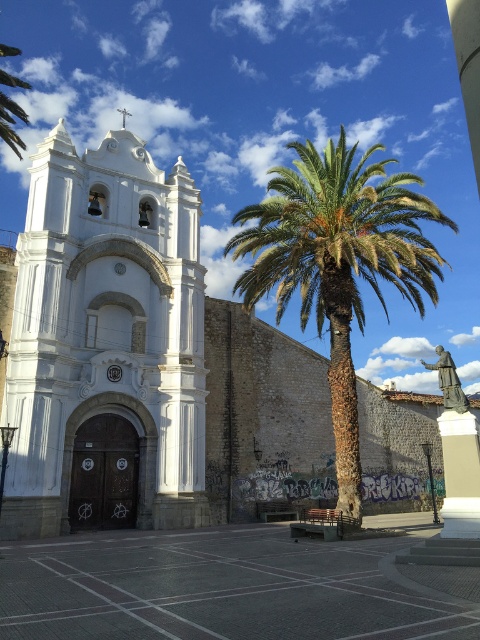
Question: Observing the image, what is the correct spatial positioning of white stone church at center in reference to gray concrete plaza at center?

Choices:
 (A) right
 (B) left

Answer: (B)

Question: Estimate the real-world distances between objects in this image. Which object is farther from the gray concrete plaza at center?

Choices:
 (A) white stone statue at center
 (B) green leafy palm at center

Answer: (B)

Question: Which point is closer to the camera?

Choices:
 (A) (168, 390)
 (B) (447, 420)
 (C) (340, 378)

Answer: (B)

Question: Which of the following is the closest to the observer?

Choices:
 (A) green leafy palm at center
 (B) gray concrete plaza at center
 (C) white stone statue at center

Answer: (B)

Question: Does gray concrete plaza at center have a larger size compared to white stone statue at center?

Choices:
 (A) yes
 (B) no

Answer: (A)

Question: Is white stone church at center closer to the viewer compared to green leafy palm at center?

Choices:
 (A) yes
 (B) no

Answer: (A)